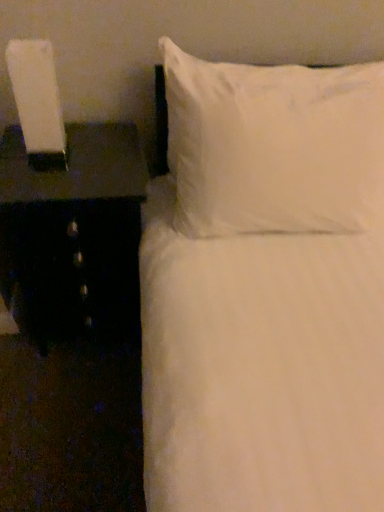
Question: Should I look upward or downward to see white soft pillow at upper right?

Choices:
 (A) down
 (B) up

Answer: (B)

Question: From a real-world perspective, is white soft pillow at upper right on top of black glossy nightstand at left?

Choices:
 (A) no
 (B) yes

Answer: (B)

Question: Is white soft pillow at upper right thinner than black glossy nightstand at left?

Choices:
 (A) yes
 (B) no

Answer: (A)

Question: From a real-world perspective, is white soft pillow at upper right located beneath black glossy nightstand at left?

Choices:
 (A) yes
 (B) no

Answer: (B)

Question: From the image's perspective, is white soft pillow at upper right below black glossy nightstand at left?

Choices:
 (A) yes
 (B) no

Answer: (B)

Question: Is white soft pillow at upper right taller than black glossy nightstand at left?

Choices:
 (A) no
 (B) yes

Answer: (A)

Question: Does white soft pillow at upper right come behind black glossy nightstand at left?

Choices:
 (A) yes
 (B) no

Answer: (B)

Question: Would you say black glossy nightstand at left contains white soft pillow at upper right?

Choices:
 (A) no
 (B) yes

Answer: (A)

Question: Can you confirm if black glossy nightstand at left is shorter than white soft pillow at upper right?

Choices:
 (A) no
 (B) yes

Answer: (A)

Question: From the image's perspective, is black glossy nightstand at left below white soft pillow at upper right?

Choices:
 (A) no
 (B) yes

Answer: (B)

Question: Is black glossy nightstand at left completely or partially outside of white soft pillow at upper right?

Choices:
 (A) no
 (B) yes

Answer: (B)

Question: Is black glossy nightstand at left to the left of white soft pillow at upper right from the viewer's perspective?

Choices:
 (A) yes
 (B) no

Answer: (A)

Question: From a real-world perspective, is black glossy nightstand at left on white soft pillow at upper right?

Choices:
 (A) no
 (B) yes

Answer: (A)

Question: Is white glossy lamp at left turned away from white soft pillow at upper right?

Choices:
 (A) no
 (B) yes

Answer: (A)